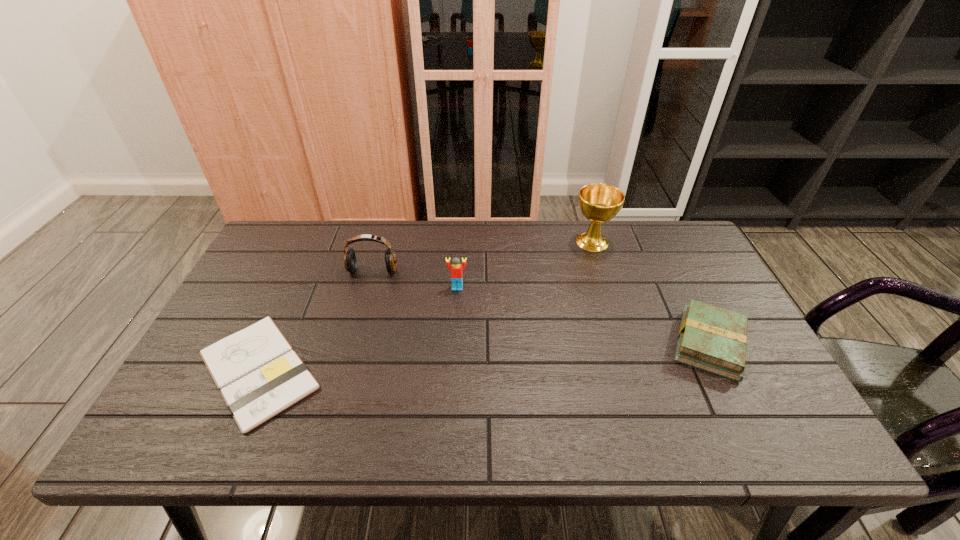
At what (x,y) coordinates should I click in order to perform the action: click on vacant space at the far edge of the desktop. Please return your answer as a coordinate pair (x, y). The height and width of the screenshot is (540, 960). Looking at the image, I should click on (396, 228).

Identify the location of free space at the near edge of the desktop. This screenshot has height=540, width=960. (619, 438).

This screenshot has height=540, width=960. In the image, there is a desktop. In order to click on free space at the left edge in this screenshot , I will do `click(226, 312)`.

At what (x,y) coordinates should I click in order to perform the action: click on vacant space at the right edge of the desktop. Please return your answer as a coordinate pair (x, y). Image resolution: width=960 pixels, height=540 pixels. Looking at the image, I should click on (760, 376).

In the image, there is a desktop. Where is `vacant region at the far left corner`? vacant region at the far left corner is located at coordinates point(313,243).

Locate an element on the screen. free space at the far right corner is located at coordinates click(679, 235).

Image resolution: width=960 pixels, height=540 pixels. In order to click on free spot between the tallest object and the notepad in this screenshot , I will do `click(425, 306)`.

Image resolution: width=960 pixels, height=540 pixels. Identify the location of free area in between the second object from right to left and the fourth nearest object. (483, 256).

The width and height of the screenshot is (960, 540). Find the location of `vacant region between the fourth nearest object and the second object from right to left`. vacant region between the fourth nearest object and the second object from right to left is located at coordinates (483, 256).

Identify the location of blank region between the third nearest object and the second shortest object. Image resolution: width=960 pixels, height=540 pixels. (584, 316).